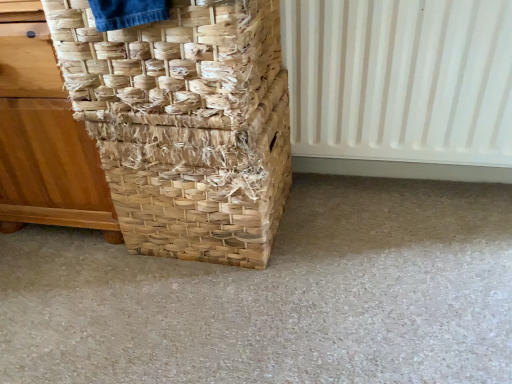
Question: Does natural woven basket at left appear on the left side of natural woven basket at left, the 2th basket when ordered from bottom to top?

Choices:
 (A) yes
 (B) no

Answer: (A)

Question: Is natural woven basket at left oriented towards natural woven basket at left, positioned as the 1th basket in top-to-bottom order?

Choices:
 (A) no
 (B) yes

Answer: (A)

Question: Is natural woven basket at left far from natural woven basket at left, the 2th basket when ordered from bottom to top?

Choices:
 (A) no
 (B) yes

Answer: (A)

Question: Is the position of natural woven basket at left less distant than that of natural woven basket at left, positioned as the 1th basket in top-to-bottom order?

Choices:
 (A) no
 (B) yes

Answer: (A)

Question: Does natural woven basket at left have a greater width compared to natural woven basket at left, the 2th basket when ordered from bottom to top?

Choices:
 (A) yes
 (B) no

Answer: (A)

Question: Is natural woven basket at left not within natural woven basket at left, the 2th basket when ordered from bottom to top?

Choices:
 (A) no
 (B) yes

Answer: (B)

Question: Considering the relative sizes of white plastic radiator at right and natural woven basket at left in the image provided, is white plastic radiator at right bigger than natural woven basket at left?

Choices:
 (A) yes
 (B) no

Answer: (B)

Question: Is white plastic radiator at right wider than natural woven basket at left?

Choices:
 (A) yes
 (B) no

Answer: (B)

Question: Is the depth of white plastic radiator at right greater than that of natural woven basket at left?

Choices:
 (A) yes
 (B) no

Answer: (A)

Question: Does white plastic radiator at right contain natural woven basket at left?

Choices:
 (A) no
 (B) yes

Answer: (A)

Question: From the image's perspective, is white plastic radiator at right on top of natural woven basket at left?

Choices:
 (A) no
 (B) yes

Answer: (B)

Question: From a real-world perspective, is white plastic radiator at right beneath natural woven basket at left?

Choices:
 (A) no
 (B) yes

Answer: (A)

Question: Would you say natural woven basket at left contains natural woven basket at center, the first basket ordered from the bottom?

Choices:
 (A) no
 (B) yes

Answer: (A)